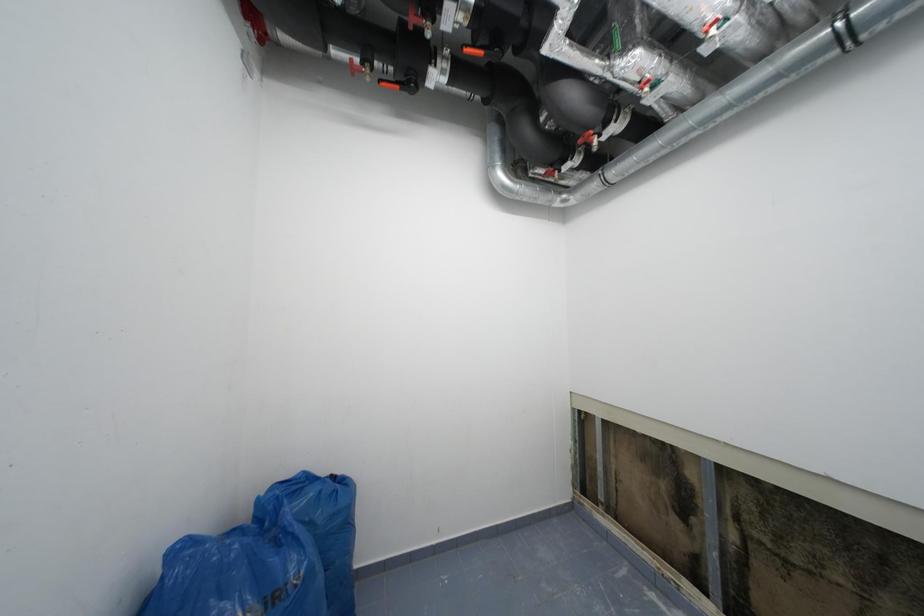
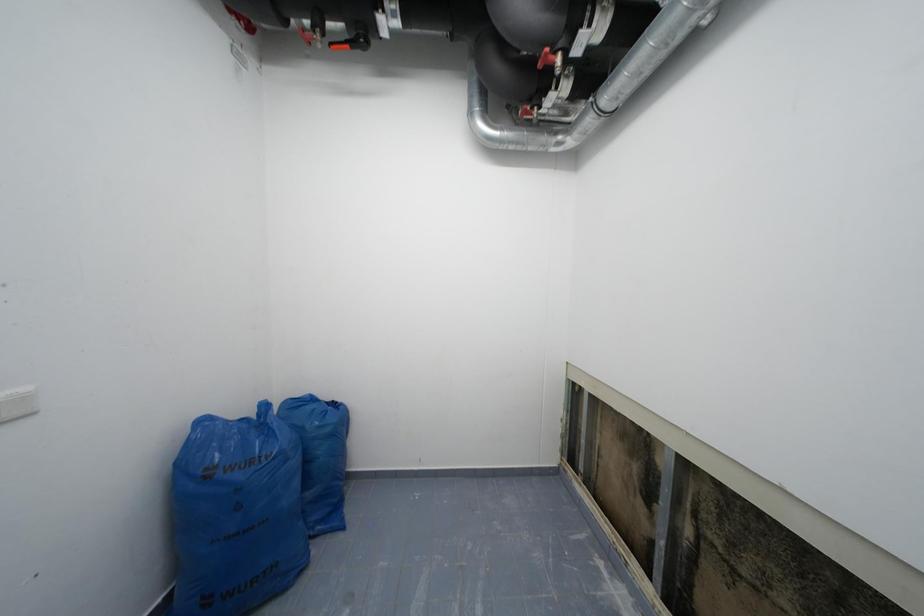
Question: The camera is either moving clockwise (left) or counter-clockwise (right) around the object. The first image is from the beginning of the video and the second image is from the end. Is the camera moving left or right when shooting the video?

Choices:
 (A) Left
 (B) Right

Answer: (B)